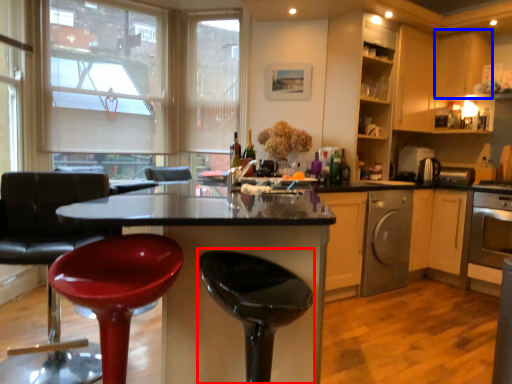
Question: Among these objects, which one is farthest to the camera, bar stool (highlighted by a red box) or cabinetry (highlighted by a blue box)?

Choices:
 (A) bar stool
 (B) cabinetry

Answer: (B)